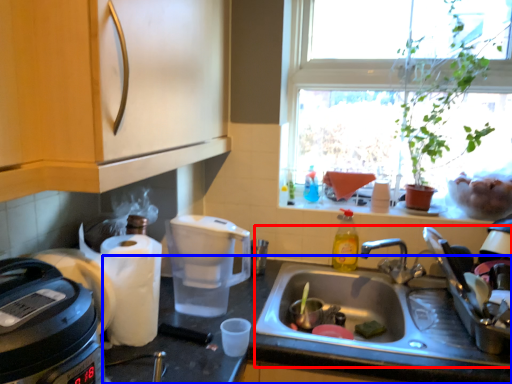
Question: Which object is closer to the camera taking this photo, sink (highlighted by a red box) or countertop (highlighted by a blue box)?

Choices:
 (A) sink
 (B) countertop

Answer: (B)